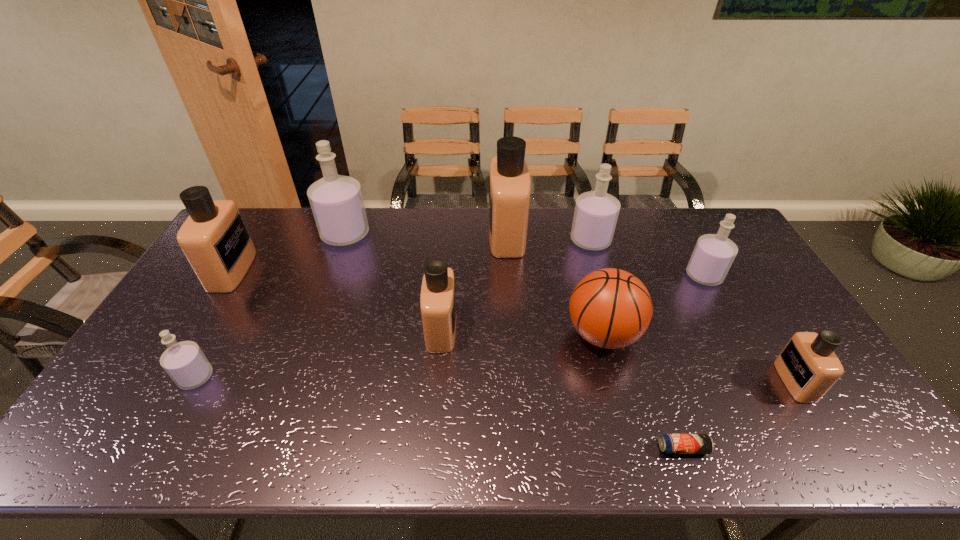
Find the location of a particular element. vacant space located on the front label of the smallest beige perfume is located at coordinates (725, 381).

This screenshot has height=540, width=960. What are the coordinates of `free region located on the left of the shortest object` in the screenshot? It's located at (607, 448).

Find the location of `object that is positioned at the near edge`. object that is positioned at the near edge is located at coordinates (669, 443).

The height and width of the screenshot is (540, 960). I want to click on vacant space at the far edge of the desktop, so click(x=385, y=245).

Identify the location of free location at the near edge. [x=667, y=433].

Where is `free region at the right edge`? Image resolution: width=960 pixels, height=540 pixels. free region at the right edge is located at coordinates (787, 320).

Image resolution: width=960 pixels, height=540 pixels. Find the location of `vacant space at the far right corner of the desktop`. vacant space at the far right corner of the desktop is located at coordinates (699, 234).

Identify the location of empty location between the nearest beige perfume and the third biggest beige perfume. The width and height of the screenshot is (960, 540). (618, 355).

At what (x,y) coordinates should I click in order to perform the action: click on free space between the shortest object and the leftmost purple perfume. Please return your answer as a coordinate pair (x, y). The width and height of the screenshot is (960, 540). Looking at the image, I should click on point(440,413).

You are a GUI agent. You are given a task and a screenshot of the screen. Output one action in this format:
    pyautogui.click(x=<x>, y=<y>)
    Task: Click on the empty location between the nearest beige perfume and the fourth object from left to right
    
    Given the screenshot: What is the action you would take?
    pyautogui.click(x=618, y=355)